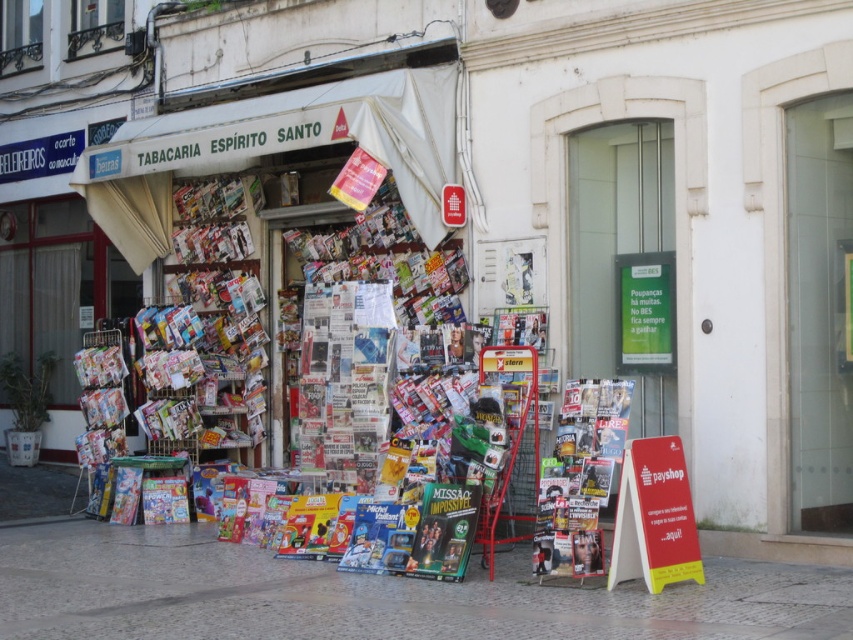
Which is behind, point (641, 625) or point (366, 115)?

The point (366, 115) is behind.

Is point (579, 605) farther from camera compared to point (426, 240)?

That is False.

What do you see at coordinates (372, 595) in the screenshot? The width and height of the screenshot is (853, 640). I see `smooth stone pavement at lower center` at bounding box center [372, 595].

This screenshot has width=853, height=640. Find the location of `smooth stone pavement at lower center`. smooth stone pavement at lower center is located at coordinates (372, 595).

Is smooth stone pavement at lower center to the right of shiny metallic magazine at center from the viewer's perspective?

In fact, smooth stone pavement at lower center is to the left of shiny metallic magazine at center.

Can you confirm if smooth stone pavement at lower center is wider than shiny metallic magazine at center?

Correct, the width of smooth stone pavement at lower center exceeds that of shiny metallic magazine at center.

What do you see at coordinates (372, 595) in the screenshot? The height and width of the screenshot is (640, 853). I see `smooth stone pavement at lower center` at bounding box center [372, 595].

Identify the location of smooth stone pavement at lower center. (372, 595).

Based on the photo, is white fabric canopy at center shorter than shiny metallic magazine at center?

Incorrect, white fabric canopy at center's height does not fall short of shiny metallic magazine at center's.

Is white fabric canopy at center smaller than shiny metallic magazine at center?

No.

Image resolution: width=853 pixels, height=640 pixels. What do you see at coordinates (280, 147) in the screenshot?
I see `white fabric canopy at center` at bounding box center [280, 147].

Locate an element on the screen. The width and height of the screenshot is (853, 640). white fabric canopy at center is located at coordinates (280, 147).